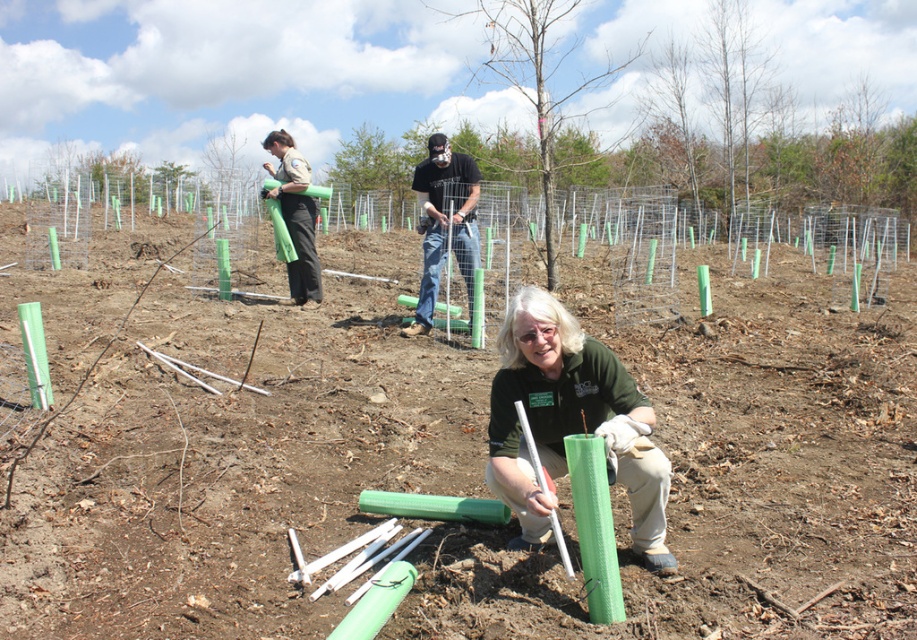
Can you confirm if green textured pipe at center is bigger than brushed metal pipe at upper center?

Correct, green textured pipe at center is larger in size than brushed metal pipe at upper center.

Between point (109, 497) and point (294, 157), which one is positioned behind?

Point (294, 157)

Between point (772, 484) and point (304, 268), which one is positioned in front?

Point (772, 484) is in front.

You are a GUI agent. You are given a task and a screenshot of the screen. Output one action in this format:
    pyautogui.click(x=<x>, y=<y>)
    Task: Click on the green textured pipe at center
    This screenshot has height=640, width=917.
    Given the screenshot: What is the action you would take?
    pyautogui.click(x=231, y=467)

The height and width of the screenshot is (640, 917). Describe the element at coordinates (231, 467) in the screenshot. I see `green textured pipe at center` at that location.

Can you confirm if green textured pipe at center is positioned below smooth bark tree at center?

Yes, green textured pipe at center is below smooth bark tree at center.

Is point (251, 525) in front of point (504, 77)?

Yes, point (251, 525) is in front of point (504, 77).

You are a GUI agent. You are given a task and a screenshot of the screen. Output one action in this format:
    pyautogui.click(x=<x>, y=<y>)
    Task: Click on the green textured pipe at center
    The image size is (917, 640).
    Given the screenshot: What is the action you would take?
    pyautogui.click(x=231, y=467)

Is brushed metal pipe at upper center thinner than smooth green pole at upper left?

Indeed, brushed metal pipe at upper center has a lesser width compared to smooth green pole at upper left.

Image resolution: width=917 pixels, height=640 pixels. Describe the element at coordinates (295, 214) in the screenshot. I see `brushed metal pipe at upper center` at that location.

Is point (278, 150) positioned before point (222, 164)?

That is True.

Identify the location of brushed metal pipe at upper center. The width and height of the screenshot is (917, 640). (295, 214).